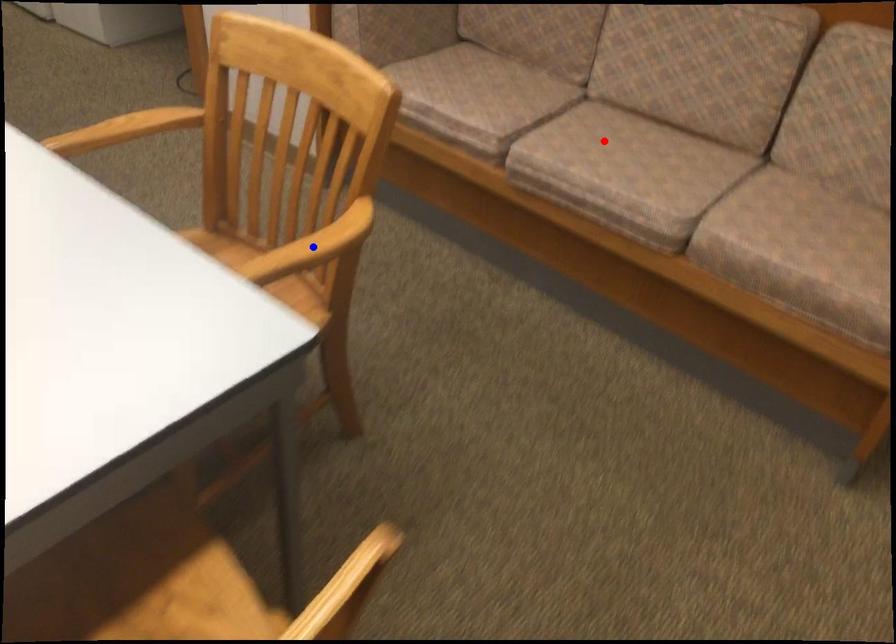
Question: Two points are marked on the image. Which point is closer to the camera?

Choices:
 (A) Blue point is closer.
 (B) Red point is closer.

Answer: (A)